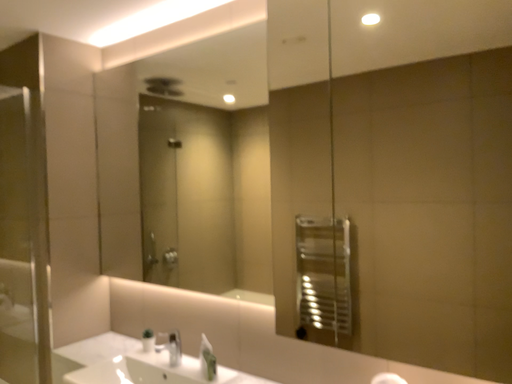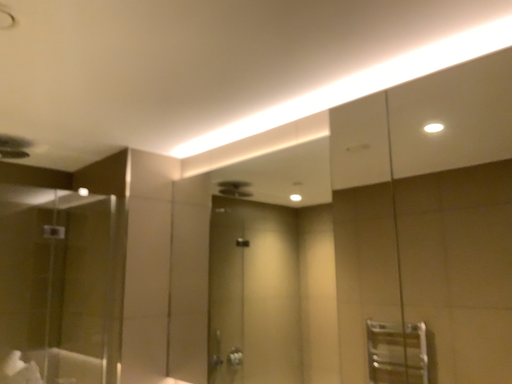
Question: Which way did the camera rotate in the video?

Choices:
 (A) rotated left
 (B) rotated right

Answer: (A)